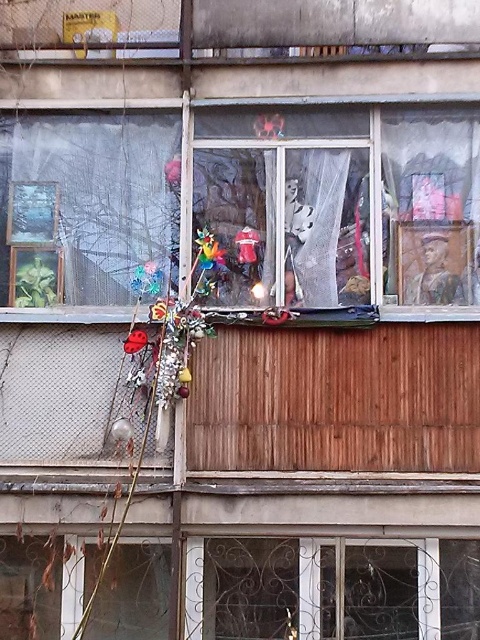
You are standing on the sidewalk in front of the building. You see the transparent plastic window at center and the shiny red toy at center. Which object is taller?

The transparent plastic window at center is much taller than the shiny red toy at center.

You are standing in front of the building facade and want to know which window is closer to you. You see the transparent plastic window at center and the transparent plastic window at upper left. Which one is closer?

The transparent plastic window at center is closer to you because it is in front of the transparent plastic window at upper left.

You are an architect designing a new building and want to ensure that the transparent plastic window at center and the transparent plastic window at upper left are proportionate. Based on the scene, which window should be made taller to maintain the current design proportions?

The transparent plastic window at center should be made taller than the transparent plastic window at upper left to maintain the current design proportions.